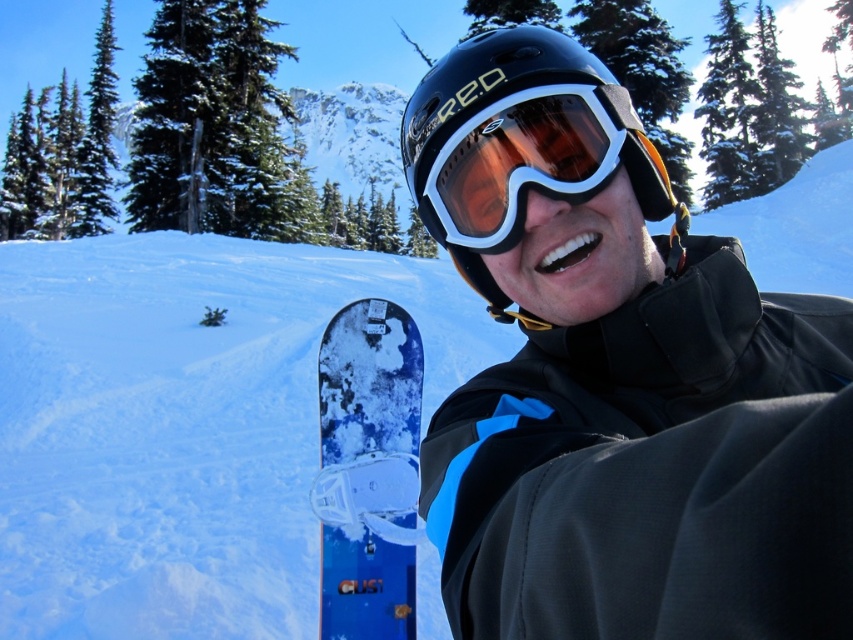
In the scene shown: Is the position of black matte snowboard at center more distant than that of matte black goggles at center?

No.

Is point (827, 483) more distant than point (544, 186)?

No, it is in front of (544, 186).

Is point (674, 321) closer to camera compared to point (563, 115)?

That is True.

This screenshot has width=853, height=640. I want to click on black matte snowboard at center, so click(618, 380).

Is black matte snowboard at center wider than blue matte snowboard at lower center?

Yes.

The width and height of the screenshot is (853, 640). Find the location of `black matte snowboard at center`. black matte snowboard at center is located at coordinates (618, 380).

Can you confirm if black matte snowboard at center is positioned below black matte helmet at center?

Yes, black matte snowboard at center is below black matte helmet at center.

Describe the element at coordinates (618, 380) in the screenshot. I see `black matte snowboard at center` at that location.

You are a GUI agent. You are given a task and a screenshot of the screen. Output one action in this format:
    pyautogui.click(x=<x>, y=<y>)
    Task: Click on the black matte snowboard at center
    This screenshot has width=853, height=640.
    Given the screenshot: What is the action you would take?
    pyautogui.click(x=618, y=380)